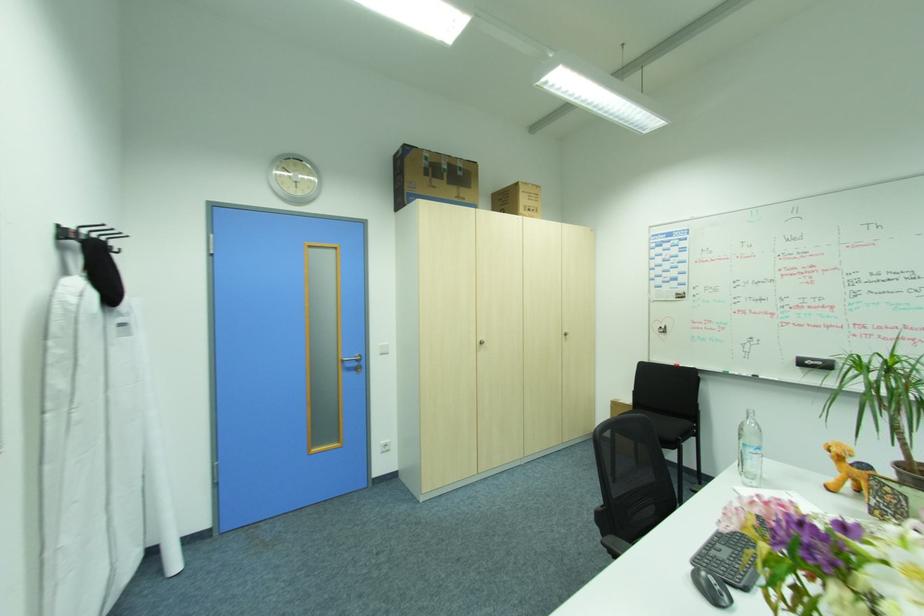
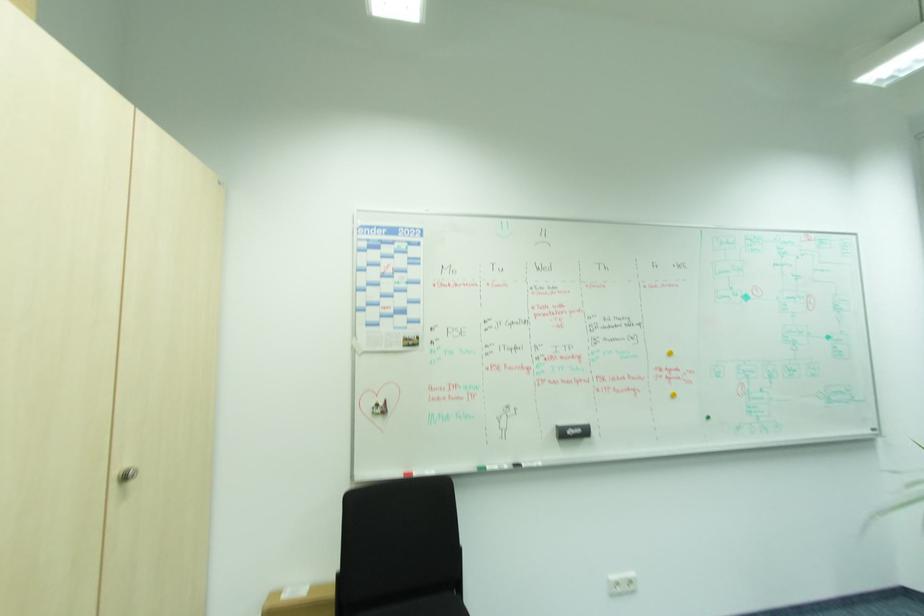
Find the pixel in the second image that matches (682,363) in the first image.

(412, 469)